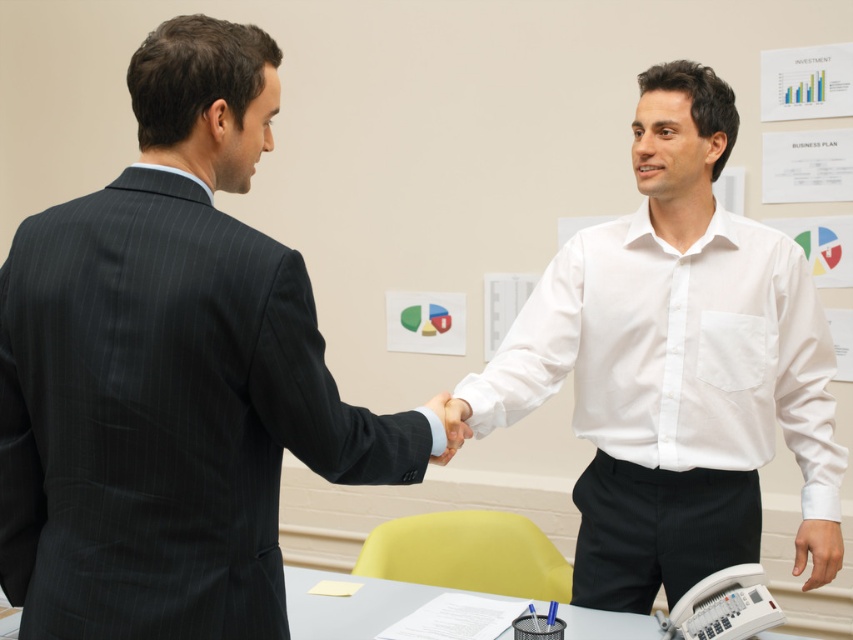
Does point (137, 307) come behind point (438, 406)?

That is False.

Can you confirm if dark pinstripe suit at center is smaller than white matte hand at center?

No, dark pinstripe suit at center is not smaller than white matte hand at center.

Is point (1, 272) behind point (453, 440)?

That is False.

This screenshot has width=853, height=640. What are the coordinates of `dark pinstripe suit at center` in the screenshot? It's located at (170, 372).

Can you confirm if dark pinstripe suit at center is thinner than white cotton shirt at right?

Correct, dark pinstripe suit at center's width is less than white cotton shirt at right's.

Does point (148, 109) come closer to viewer compared to point (813, 572)?

Yes, point (148, 109) is closer to viewer.

Image resolution: width=853 pixels, height=640 pixels. In order to click on dark pinstripe suit at center in this screenshot , I will do `click(170, 372)`.

Image resolution: width=853 pixels, height=640 pixels. I want to click on dark pinstripe suit at center, so click(170, 372).

Can you confirm if white cotton shirt at right is wider than white matte hand at center?

Correct, the width of white cotton shirt at right exceeds that of white matte hand at center.

Does white cotton shirt at right appear on the right side of white matte hand at center?

Indeed, white cotton shirt at right is positioned on the right side of white matte hand at center.

You are a GUI agent. You are given a task and a screenshot of the screen. Output one action in this format:
    pyautogui.click(x=<x>, y=<y>)
    Task: Click on the white cotton shirt at right
    Image resolution: width=853 pixels, height=640 pixels.
    Given the screenshot: What is the action you would take?
    pyautogui.click(x=676, y=365)